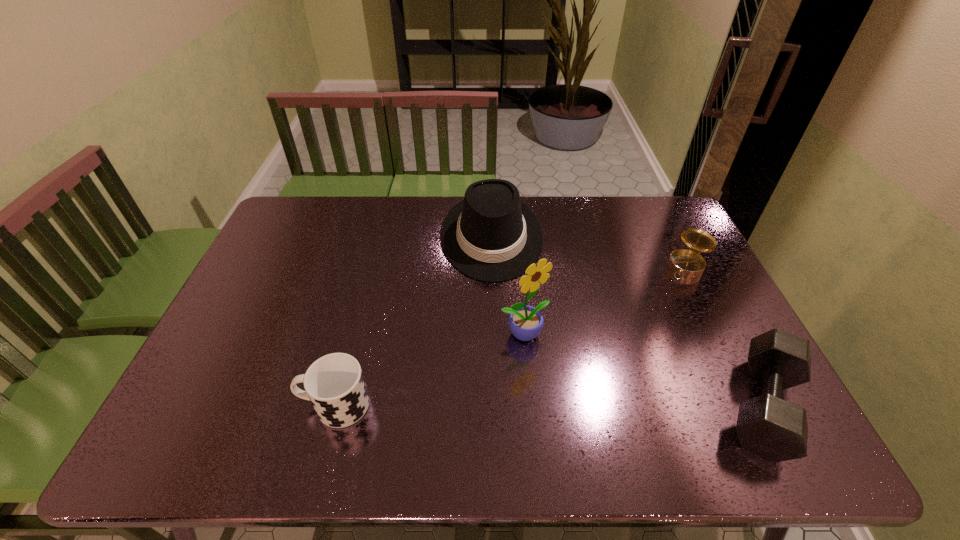
The image size is (960, 540). In order to click on cup that is at the near edge in this screenshot , I will do `click(334, 383)`.

Image resolution: width=960 pixels, height=540 pixels. I want to click on dumbbell present at the near edge, so click(767, 425).

Locate an element on the screen. This screenshot has width=960, height=540. dumbbell that is at the right edge is located at coordinates (767, 425).

Identify the location of compass that is at the right edge. (688, 263).

Where is `object that is at the near right corner`? object that is at the near right corner is located at coordinates (767, 425).

Identify the location of vacant space at the far edge of the desktop. The image size is (960, 540). (323, 231).

This screenshot has height=540, width=960. In the image, there is a desktop. Identify the location of vacant space at the near edge. (693, 383).

Where is `vacant region at the far left corner of the desktop`? The width and height of the screenshot is (960, 540). vacant region at the far left corner of the desktop is located at coordinates (320, 228).

Where is `free space between the fourth shortest object and the dumbbell`? This screenshot has width=960, height=540. free space between the fourth shortest object and the dumbbell is located at coordinates (628, 321).

I want to click on vacant space that is in between the sunflower and the leftmost object, so click(429, 369).